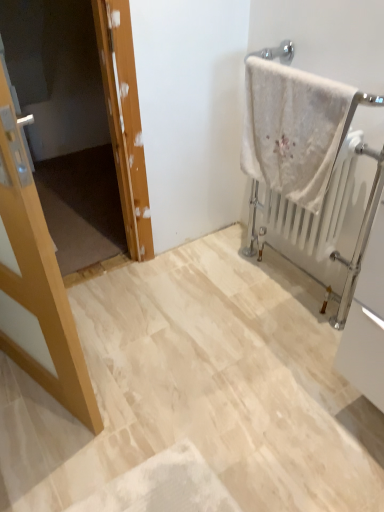
This screenshot has width=384, height=512. I want to click on free space in front of wooden door at left, so click(105, 309).